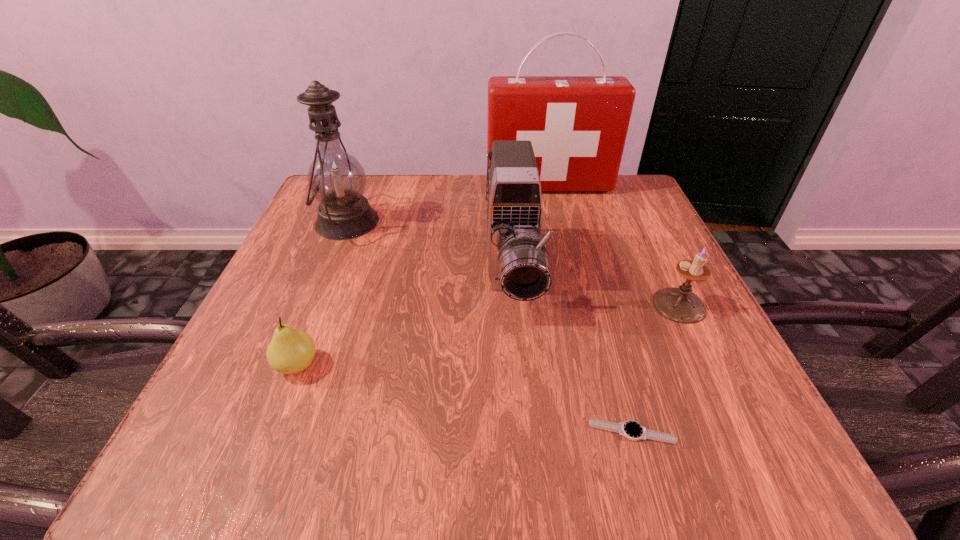
At what (x,y) coordinates should I click in order to perform the action: click on vacant point located at the front of the fourth shortest object, highlighting the lens. Please return your answer as a coordinate pair (x, y). The image size is (960, 540). Looking at the image, I should click on (522, 397).

Identify the location of free space located 0.240m on the back of the candle holder. (636, 215).

You are a GUI agent. You are given a task and a screenshot of the screen. Output one action in this format:
    pyautogui.click(x=<x>, y=<y>)
    Task: Click on the vacant space located 0.110m on the back of the fifth farthest object
    This screenshot has height=540, width=960.
    Given the screenshot: What is the action you would take?
    pyautogui.click(x=323, y=300)

Locate an element on the screen. The width and height of the screenshot is (960, 540). blank area located 0.100m on the left of the watch is located at coordinates (515, 432).

Identify the location of the first-aid kit that is at the far edge. (577, 125).

Where is `oil lamp located at the far edge`? oil lamp located at the far edge is located at coordinates (336, 179).

Locate an element on the screen. This screenshot has height=540, width=960. object positioned at the near edge is located at coordinates (632, 430).

Find the location of a particular element. oil lamp at the left edge is located at coordinates (336, 179).

At what (x,y) coordinates should I click in order to perform the action: click on pear that is at the left edge. Please return your answer as a coordinate pair (x, y). This screenshot has width=960, height=540. Looking at the image, I should click on 290,351.

Locate an element on the screen. The height and width of the screenshot is (540, 960). the first-aid kit present at the right edge is located at coordinates (577, 125).